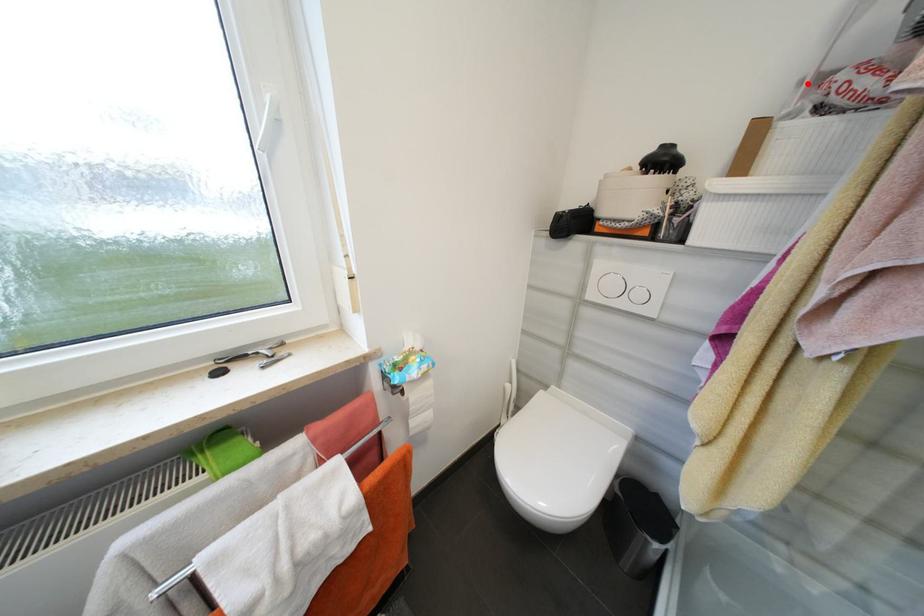
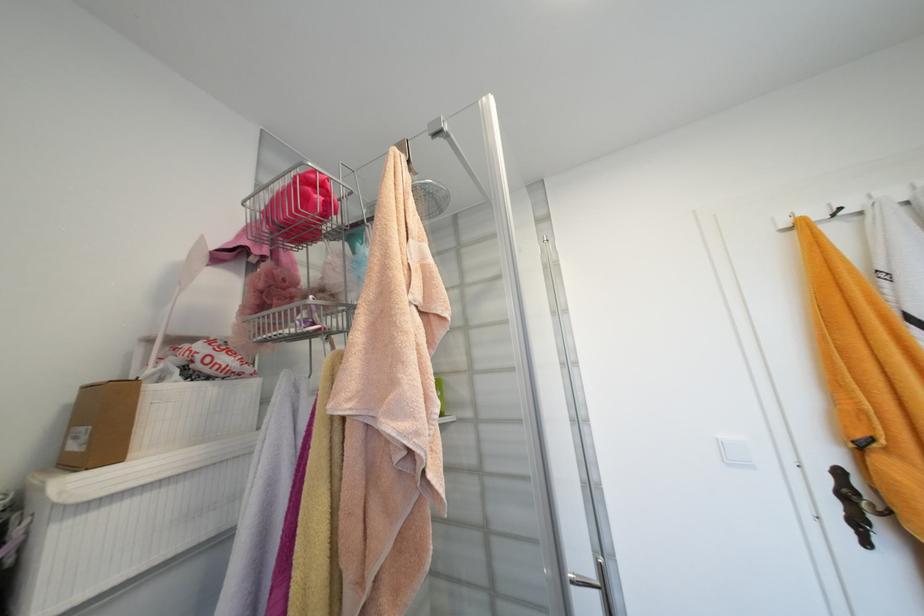
Question: I am providing you with two images of the same scene from different viewpoints. A red point is marked on the first image. Is the red point's position out of view in image 2?

Choices:
 (A) Yes
 (B) No

Answer: (B)